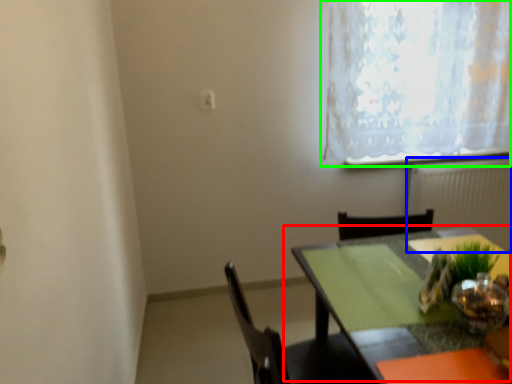
Question: Considering the real-world distances, which object is farthest from table (highlighted by a red box)? radiator (highlighted by a blue box) or window (highlighted by a green box)?

Choices:
 (A) radiator
 (B) window

Answer: (A)